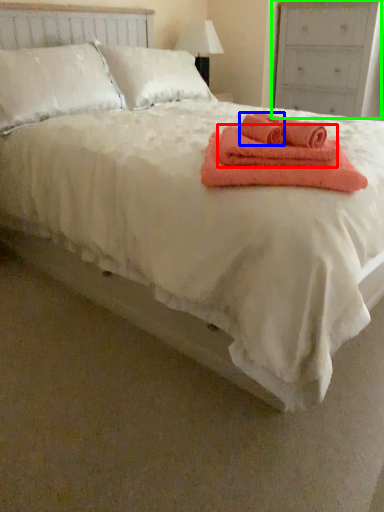
Question: Based on their relative distances, which object is nearer to bath towel (highlighted by a red box)? Choose from bath towel (highlighted by a blue box) and dresser (highlighted by a green box).

Choices:
 (A) bath towel
 (B) dresser

Answer: (A)